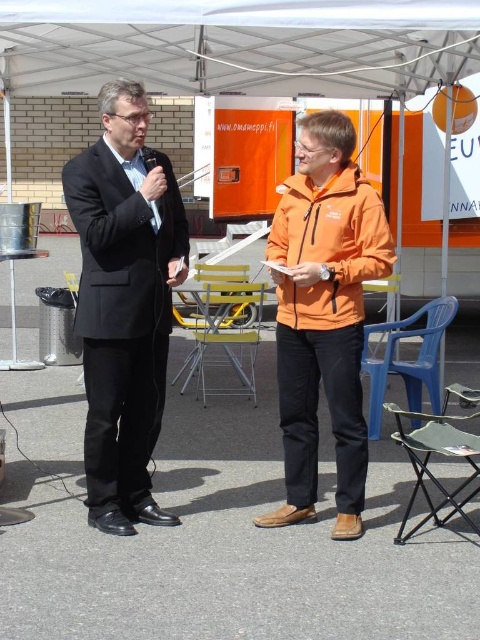
You are organizing a small outdoor event and need to arrange seating based on the participants. The two people in the image are part of the event. The person in the matte black suit at left is a speaker, and the person in the orange softshell jacket at center is an attendee. You have a limited number of seats. Which participant should you prioritize seating first to ensure they can comfortably reach their assigned seat before the event starts?

The matte black suit at left should be prioritized because they are taller than the orange softshell jacket at center and may need more space or adjustments for seating.

You are organizing a community event and need to identify which orange jacket is on the left side between the orange matte jacket at center and the orange softshell jacket at center. Which one should you choose?

The orange softshell jacket at center is on the left side because the orange matte jacket at center is positioned on the right side of it.